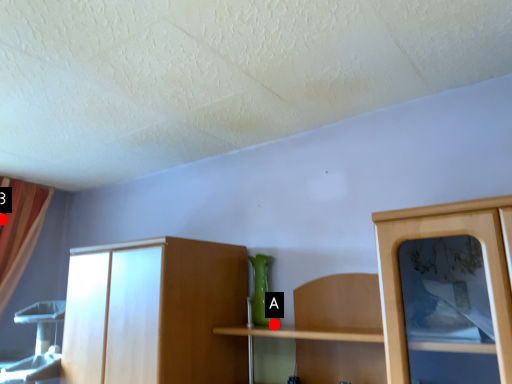
Question: Two points are circled on the image, labeled by A and B beside each circle. Which point is farther from the camera taking this photo?

Choices:
 (A) A is further
 (B) B is further

Answer: (B)